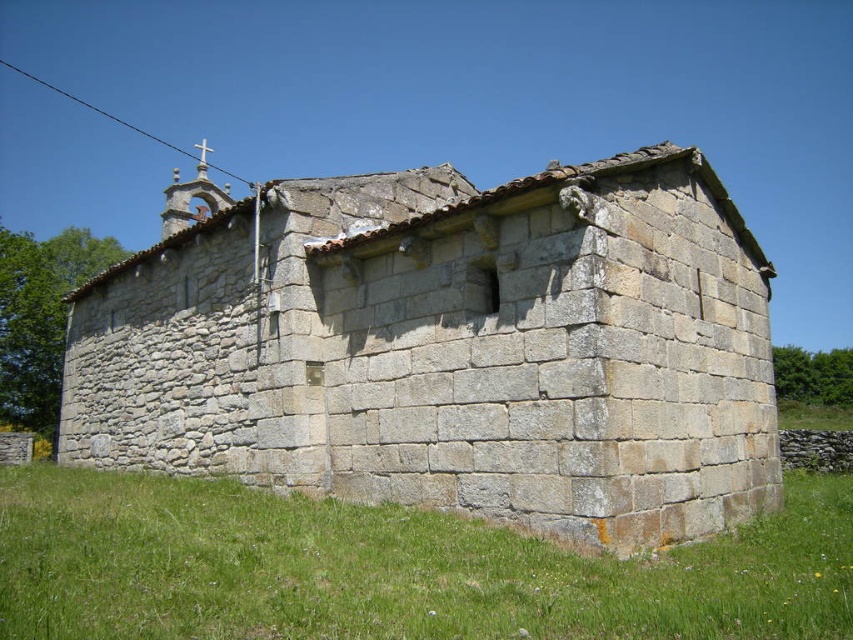
Question: From the image, what is the correct spatial relationship of gray stone church at center in relation to green grass at lower right?

Choices:
 (A) below
 (B) above

Answer: (B)

Question: Does gray stone church at center appear on the left side of green grass at lower right?

Choices:
 (A) no
 (B) yes

Answer: (B)

Question: Does gray stone church at center have a lesser width compared to green grass at lower right?

Choices:
 (A) yes
 (B) no

Answer: (B)